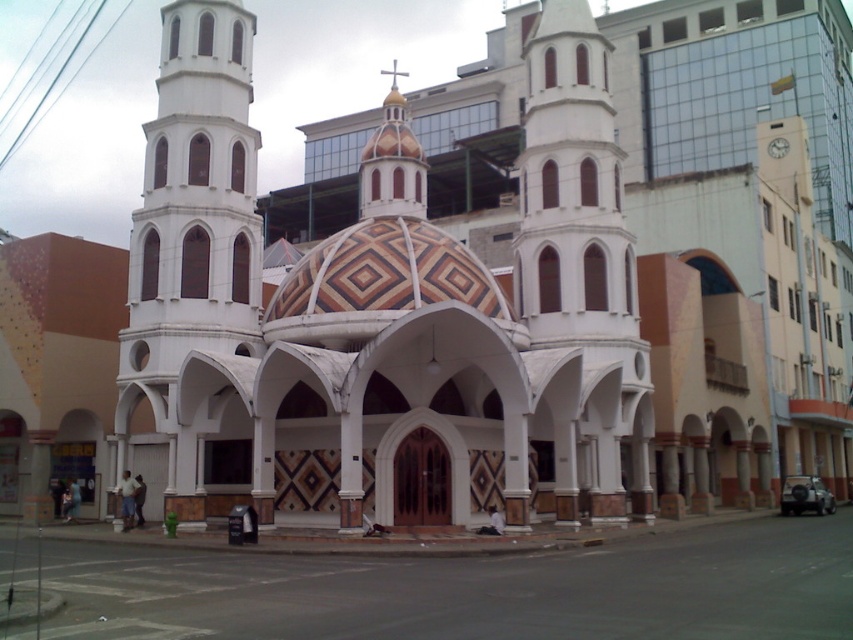
You are an architect examining the building and notice two towers at the center. Which of the two towers, the white marble tower at center or the white smooth tower at center, has a smaller width?

The white marble tower at center is thinner than the white smooth tower at center, so the white marble tower at center has a smaller width.